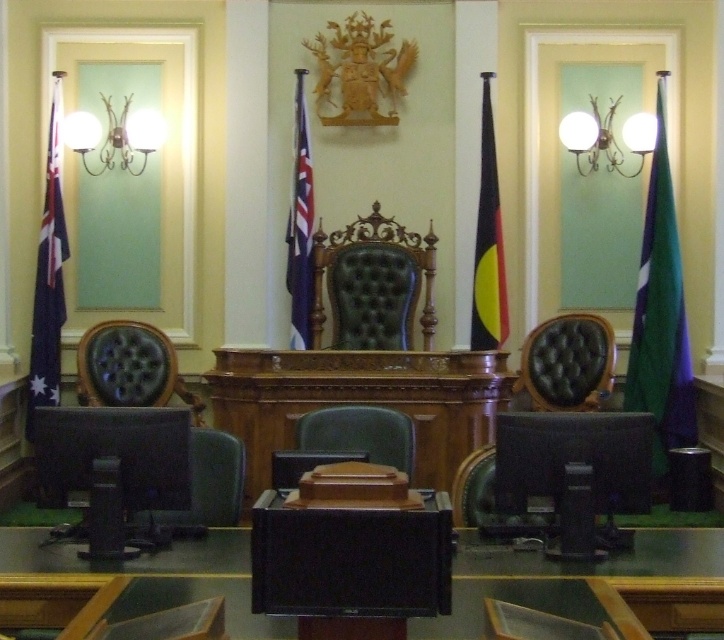
Question: Considering the real-world distances, which object is closest to the matte black flag at left?

Choices:
 (A) leather chair at center
 (B) white glass sconce at upper center

Answer: (A)

Question: Which object is the closest to the smooth black table at center?

Choices:
 (A) blue fabric flag at center
 (B) yellow and black fabric flag at center

Answer: (B)

Question: Observing the image, what is the correct spatial positioning of leather at left in reference to yellow and black fabric flag at center?

Choices:
 (A) above
 (B) below

Answer: (B)

Question: Estimate the real-world distances between objects in this image. Which object is farther from the matte black chair at center?

Choices:
 (A) matte black flag at left
 (B) leather at left
 (C) green fabric flag at right
 (D) yellow and black fabric flag at center

Answer: (C)

Question: Can you confirm if smooth black table at center is positioned to the right of green leather chair at center?

Choices:
 (A) yes
 (B) no

Answer: (A)

Question: Is leather at left positioned in front of white glass sconce at upper center?

Choices:
 (A) no
 (B) yes

Answer: (B)